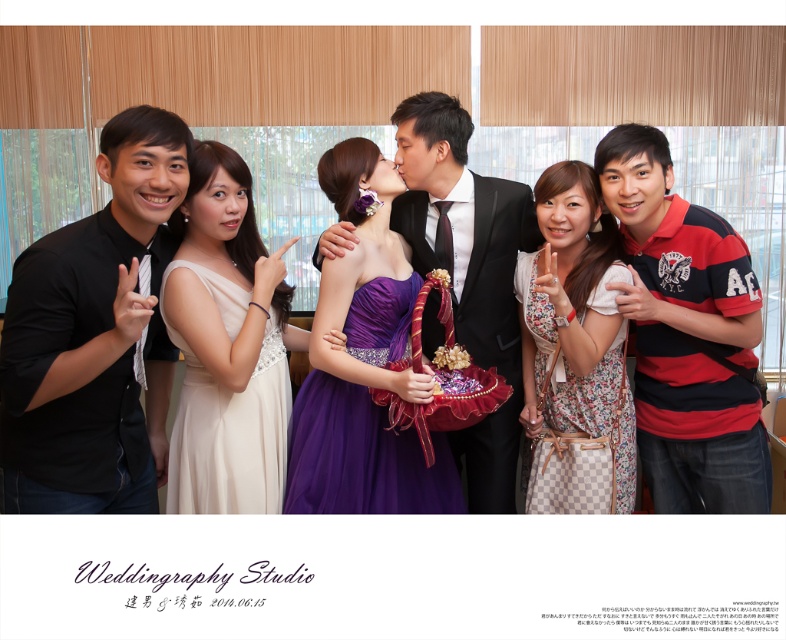
You are a photographer at Weddingraphy Studio and need to adjust the lighting for a photo of the purple satin dress at center and the ivory satin dress at center. Since the dresses are positioned vertically, which dress should you focus on first to ensure proper lighting? Please explain based on their positions.

The purple satin dress at center is below the ivory satin dress at center. Therefore, you should focus on lighting the ivory satin dress at center first, as it is higher up and adjusting its lighting will prevent casting shadows on the purple satin dress at center below.

You are a photographer at the Weddingraphy Studio and need to adjust the lighting for a better shot. The black matte shirt at left and the red striped polo shirt at right are in your frame. Which of these two shirts is positioned closer to the camera?

The black matte shirt at left is closer to the viewer than the red striped polo shirt at right, so it is positioned closer to the camera.

You are a photographer at Weddingraphy Studio and need to determine which dress is more suitable for a client who prefers a more modest look. Based on the image, which dress, the purple satin dress at center or the ivory satin dress at center, is larger in size and might offer more coverage?

The purple satin dress at center has a larger size compared to the ivory satin dress at center, so it might offer more coverage and be more suitable for a client preferring a modest look.